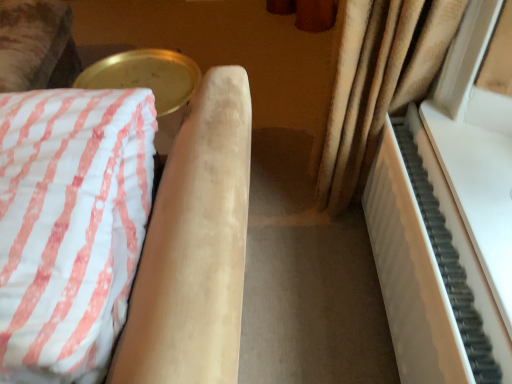
Where is `vacant space situated on the left part of white matte piano at right`? Image resolution: width=512 pixels, height=384 pixels. vacant space situated on the left part of white matte piano at right is located at coordinates (312, 299).